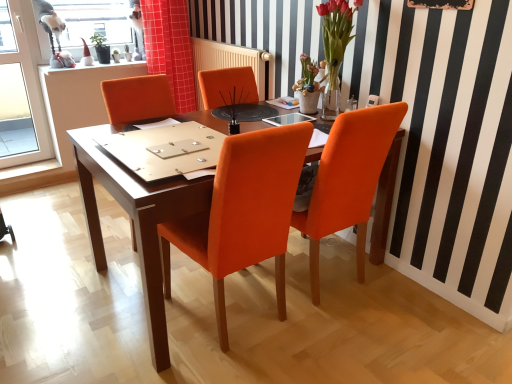
Where is `free space to the right of orange leather chair at center, which ranks as the 2th chair in right-to-left order`? This screenshot has width=512, height=384. free space to the right of orange leather chair at center, which ranks as the 2th chair in right-to-left order is located at coordinates click(x=350, y=339).